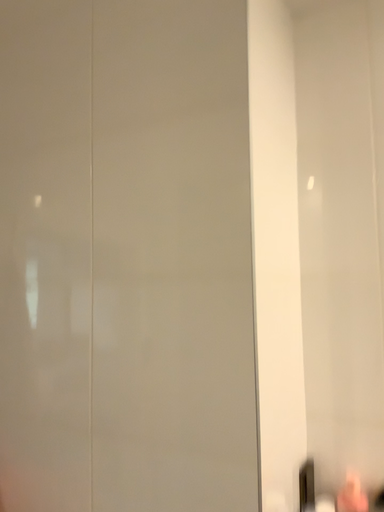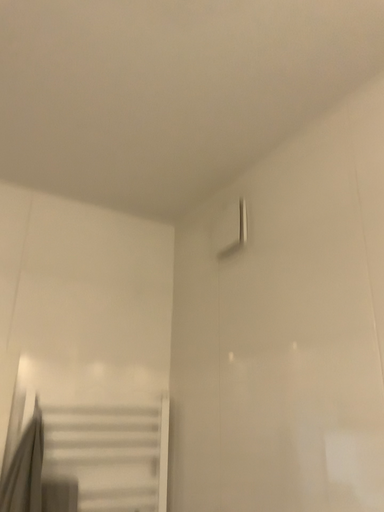
Question: How did the camera likely rotate when shooting the video?

Choices:
 (A) rotated upward
 (B) rotated downward

Answer: (A)